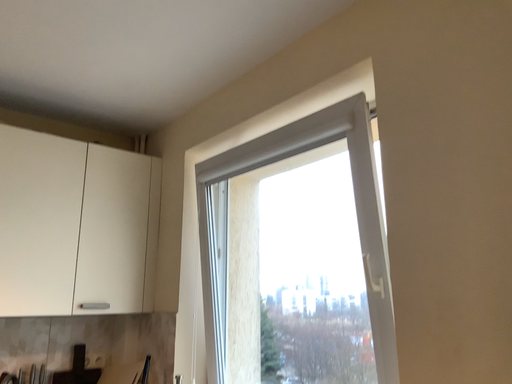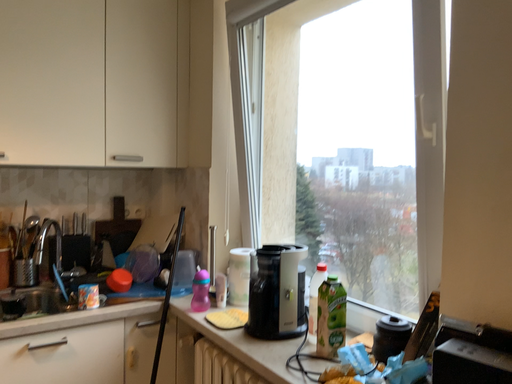
Question: How did the camera likely rotate when shooting the video?

Choices:
 (A) rotated downward
 (B) rotated upward

Answer: (A)